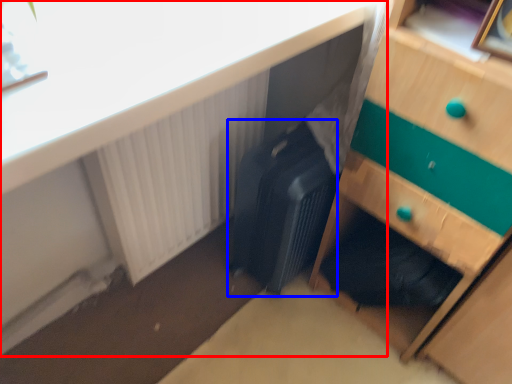
Question: Among these objects, which one is farthest to the camera, desk (highlighted by a red box) or luggage (highlighted by a blue box)?

Choices:
 (A) desk
 (B) luggage

Answer: (B)